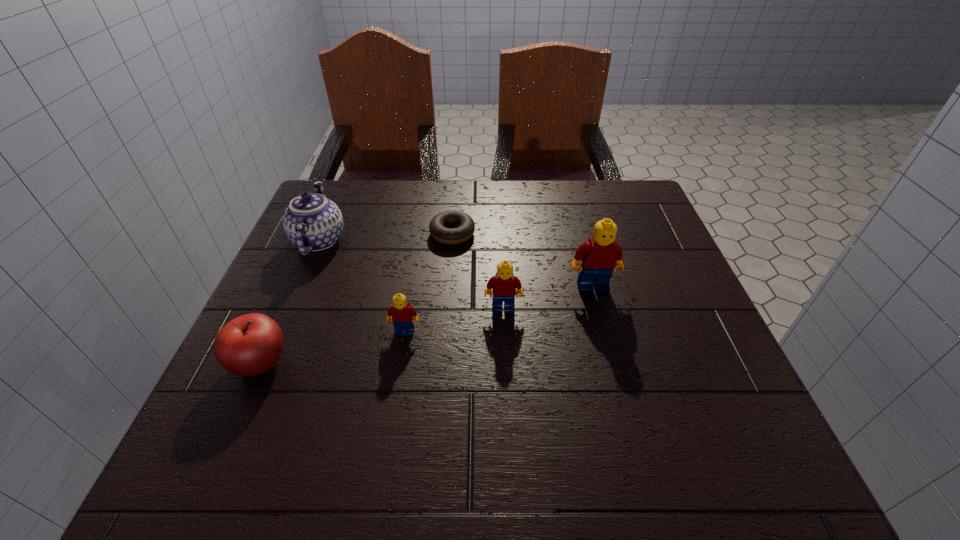
The image size is (960, 540). Find the location of `vacant area situated on the front-facing side of the fourth farthest object`. vacant area situated on the front-facing side of the fourth farthest object is located at coordinates (505, 345).

Identify the location of free space located 0.160m on the front-facing side of the farthest Lego. (611, 354).

Where is `vacant space located 0.340m at the spout of the chinaware`? This screenshot has height=540, width=960. vacant space located 0.340m at the spout of the chinaware is located at coordinates (486, 241).

Locate an element on the screen. The image size is (960, 540). blank space located 0.050m on the right of the nearest object is located at coordinates (318, 363).

This screenshot has width=960, height=540. I want to click on vacant region located 0.080m on the right of the shortest object, so click(507, 234).

In order to click on chinaware at the far edge in this screenshot , I will do `click(312, 222)`.

At what (x,y) coordinates should I click in order to perform the action: click on doughnut at the far edge. Please return your answer as a coordinate pair (x, y). Looking at the image, I should click on point(465,225).

Where is `object located at the near edge`? The image size is (960, 540). object located at the near edge is located at coordinates (251, 344).

Locate an element on the screen. The width and height of the screenshot is (960, 540). chinaware that is at the left edge is located at coordinates (312, 222).

Find the location of a particular element. The height and width of the screenshot is (540, 960). apple that is positioned at the left edge is located at coordinates (251, 344).